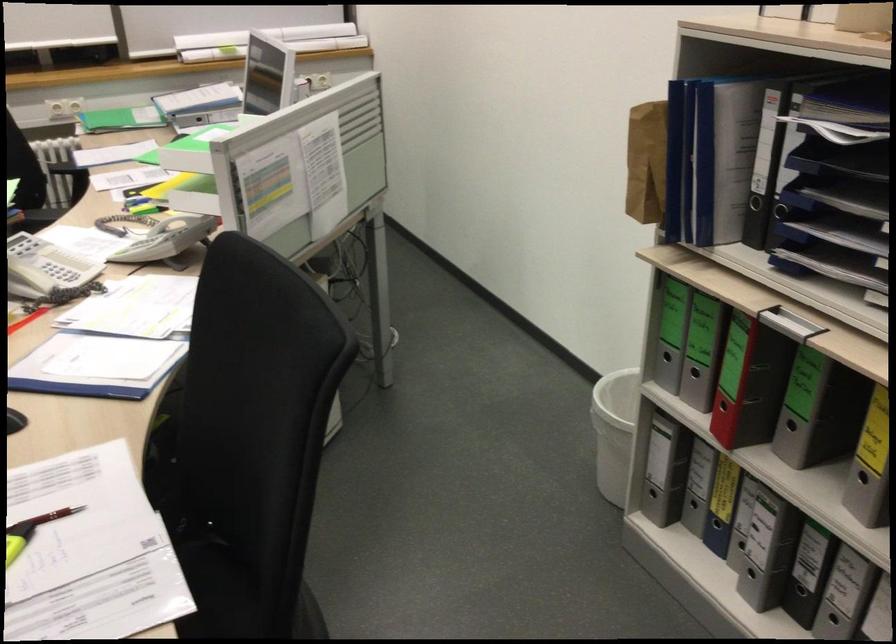
Where would you lift the telephone handset? Please return your answer as a coordinate pair (x, y).

(179, 223)